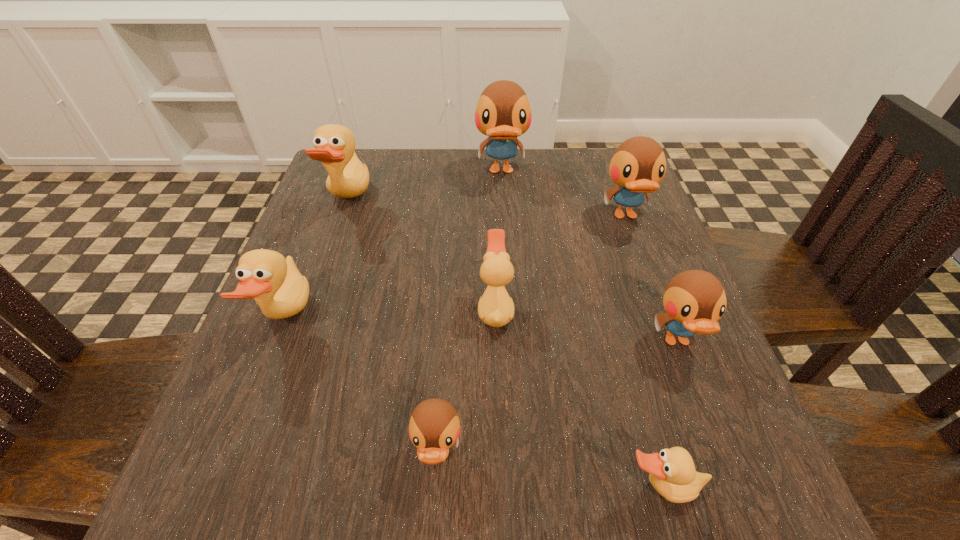
Identify the location of object that is the third closest to the third smallest tan duck. (495, 308).

Identify which object is the fourth closest to the smallest tan duck. Please provide its 2D coordinates. Your answer should be formatted as a tuple, i.e. [(x, y)], where the tuple contains the x and y coordinates of a point satisfying the conditions above.

[(638, 165)]

Find the location of a particular element. The height and width of the screenshot is (540, 960). duck that is the seventh closest one to the second smallest blue duck is located at coordinates (334, 145).

Locate which duck is the second closest to the second tan duck from right to left. Please provide its 2D coordinates. Your answer should be formatted as a tuple, i.e. [(x, y)], where the tuple contains the x and y coordinates of a point satisfying the conditions above.

[(694, 300)]

Image resolution: width=960 pixels, height=540 pixels. In order to click on blue duck that stands as the second closest to the second farthest blue duck in this screenshot , I will do `click(694, 300)`.

Where is `the second closest blue duck relative to the third blue duck from right to left`? Image resolution: width=960 pixels, height=540 pixels. the second closest blue duck relative to the third blue duck from right to left is located at coordinates (694, 300).

I want to click on tan duck that can be found as the closest to the second biggest blue duck, so click(x=495, y=308).

At what (x,y) coordinates should I click in order to perform the action: click on tan duck identified as the second closest to the second biggest tan duck. Please return your answer as a coordinate pair (x, y). The height and width of the screenshot is (540, 960). Looking at the image, I should click on (495, 308).

At what (x,y) coordinates should I click in order to perform the action: click on vacant space that satisfies the following two spatial constraints: 1. on the front-facing side of the farthest blue duck; 2. on the beak of the second smallest tan duck. Please return your answer as a coordinate pair (x, y). The image size is (960, 540). Looking at the image, I should click on (510, 309).